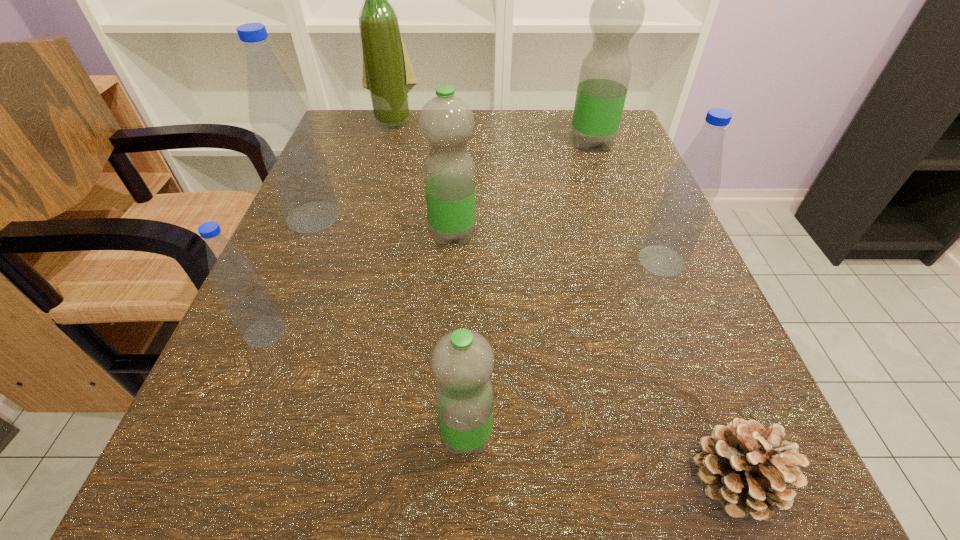
Locate an element on the screen. Image resolution: width=960 pixels, height=540 pixels. the third closest green water bottle to the smallest blue water bottle is located at coordinates (617, 13).

The image size is (960, 540). What are the coordinates of `green water bottle that is the closest to the brown pinecone` in the screenshot? It's located at (462, 361).

At what (x,y) coordinates should I click in order to perform the action: click on blue water bottle that is the second closest to the wine bottle. Please return your answer as a coordinate pair (x, y). This screenshot has height=540, width=960. Looking at the image, I should click on (249, 303).

Locate which blue water bottle is the closest to the nearest water bottle. Please provide its 2D coordinates. Your answer should be formatted as a tuple, i.e. [(x, y)], where the tuple contains the x and y coordinates of a point satisfying the conditions above.

[(249, 303)]

Find the location of a particular element. The width and height of the screenshot is (960, 540). free space that satisfies the following two spatial constraints: 1. on the front-facing side of the farthest green water bottle; 2. on the left side of the wine bottle is located at coordinates (387, 143).

I want to click on free space that satisfies the following two spatial constraints: 1. on the front side of the farthest blue water bottle; 2. on the left side of the brown pinecone, so click(x=204, y=480).

Image resolution: width=960 pixels, height=540 pixels. What are the coordinates of `vacant point that satisfies the following two spatial constraints: 1. on the front-facing side of the second smallest green water bottle; 2. on the right side of the wine bottle` in the screenshot? It's located at (361, 233).

Find the location of `vacant area in the image that satisfies the following two spatial constraints: 1. on the front-facing side of the nearest water bottle; 2. on the right side of the wine bottle`. vacant area in the image that satisfies the following two spatial constraints: 1. on the front-facing side of the nearest water bottle; 2. on the right side of the wine bottle is located at coordinates (303, 435).

Where is `vacant space that satisfies the following two spatial constraints: 1. on the front side of the second smallest blue water bottle; 2. on the left side of the biggest blue water bottle`? vacant space that satisfies the following two spatial constraints: 1. on the front side of the second smallest blue water bottle; 2. on the left side of the biggest blue water bottle is located at coordinates (296, 261).